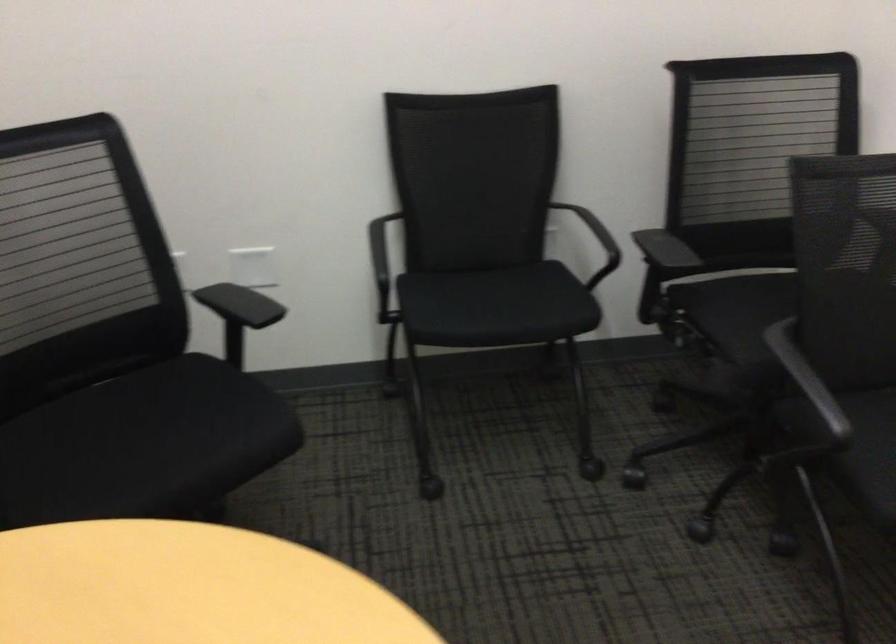
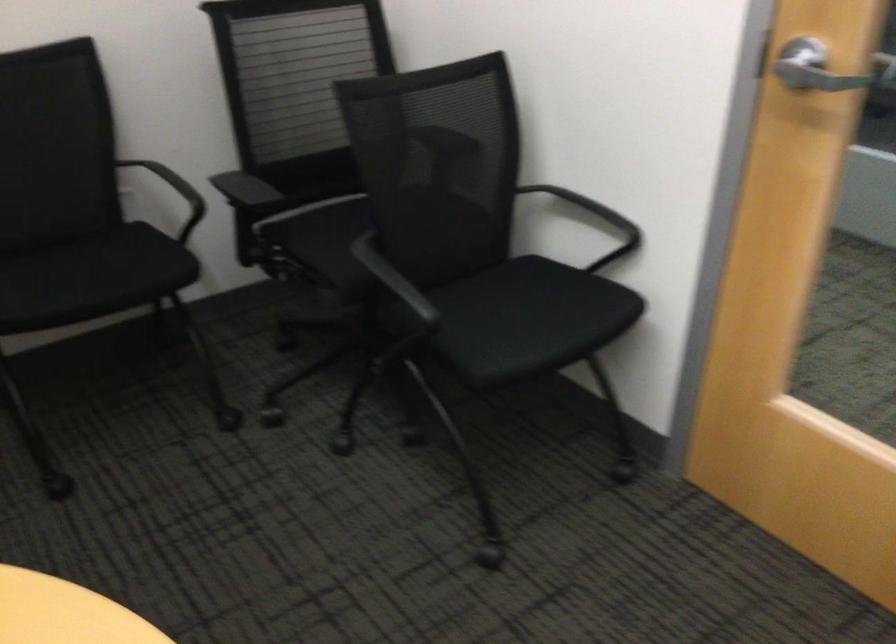
Locate, in the second image, the point that corresponds to pixel 720 328 in the first image.

(321, 254)